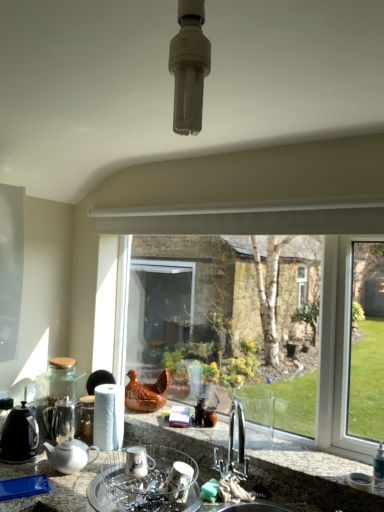
Question: Could you tell me if clear glass window at center is facing porcelain dish rack at center, the 2th appliance viewed from the back?

Choices:
 (A) no
 (B) yes

Answer: (B)

Question: From a real-world perspective, is clear glass window at center located beneath porcelain dish rack at center, the 2th appliance viewed from the back?

Choices:
 (A) no
 (B) yes

Answer: (A)

Question: Is clear glass window at center wider than porcelain dish rack at center, the 2th appliance viewed from the back?

Choices:
 (A) no
 (B) yes

Answer: (A)

Question: Does clear glass window at center contain porcelain dish rack at center, the 2th appliance viewed from the back?

Choices:
 (A) no
 (B) yes

Answer: (A)

Question: Does clear glass window at center have a greater height compared to porcelain dish rack at center, the 2th appliance viewed from the back?

Choices:
 (A) no
 (B) yes

Answer: (B)

Question: Is point tap(97, 503) positioned closer to the camera than point tap(43, 418)?

Choices:
 (A) farther
 (B) closer

Answer: (B)

Question: Relative to shiny metallic teapot at left, is porcelain dish rack at center, arranged as the first appliance when viewed from the front, in front or behind?

Choices:
 (A) front
 (B) behind

Answer: (A)

Question: Is porcelain dish rack at center, the 2th appliance viewed from the back, to the left or to the right of shiny metallic teapot at left in the image?

Choices:
 (A) right
 (B) left

Answer: (A)

Question: In terms of width, does porcelain dish rack at center, the 2th appliance viewed from the back, look wider or thinner when compared to shiny metallic teapot at left?

Choices:
 (A) wide
 (B) thin

Answer: (A)

Question: From a real-world perspective, is porcelain dish rack at center, the 2th appliance viewed from the back, positioned above or below white glossy teapot at lower left, the second kitchen appliance positioned from the left?

Choices:
 (A) below
 (B) above

Answer: (A)

Question: Is porcelain dish rack at center, the 2th appliance viewed from the back, to the left or to the right of white glossy teapot at lower left, which is the 1th kitchen appliance from right to left, in the image?

Choices:
 (A) right
 (B) left

Answer: (A)

Question: Which is correct: porcelain dish rack at center, arranged as the first appliance when viewed from the front, is inside white glossy teapot at lower left, the second kitchen appliance positioned from the left, or outside of it?

Choices:
 (A) outside
 (B) inside

Answer: (A)

Question: From the image's perspective, is porcelain dish rack at center, the 2th appliance viewed from the back, positioned above or below white glossy teapot at lower left, the second kitchen appliance positioned from the left?

Choices:
 (A) above
 (B) below

Answer: (B)

Question: Is white ceramic mug at lower center, the first appliance when ordered from back to front, situated inside clear glass window at center or outside?

Choices:
 (A) inside
 (B) outside

Answer: (B)

Question: From a real-world perspective, is white ceramic mug at lower center, which ranks as the 2th appliance in front-to-back order, above or below clear glass window at center?

Choices:
 (A) above
 (B) below

Answer: (B)